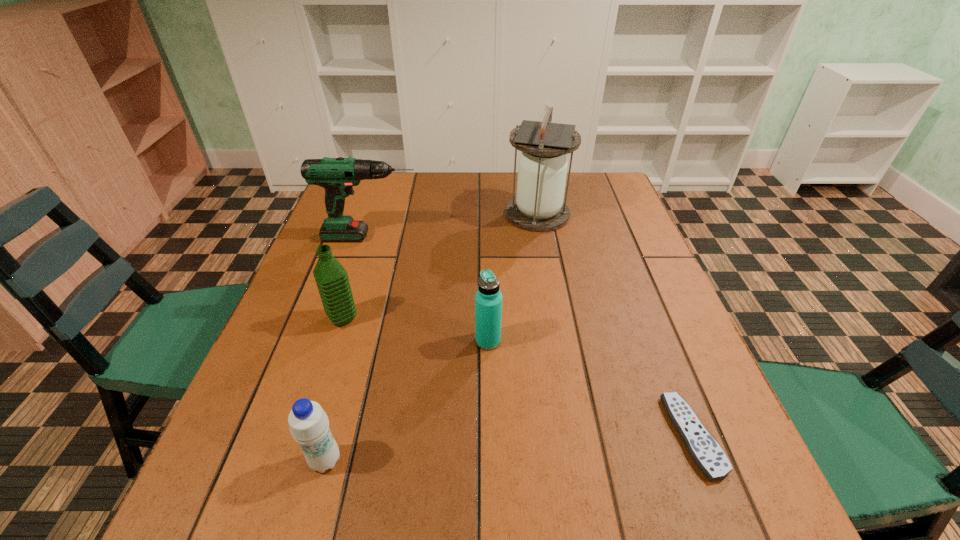
Locate an element on the screen. vacant region that satisfies the following two spatial constraints: 1. on the back side of the rightmost object; 2. on the handle side of the drill is located at coordinates (615, 237).